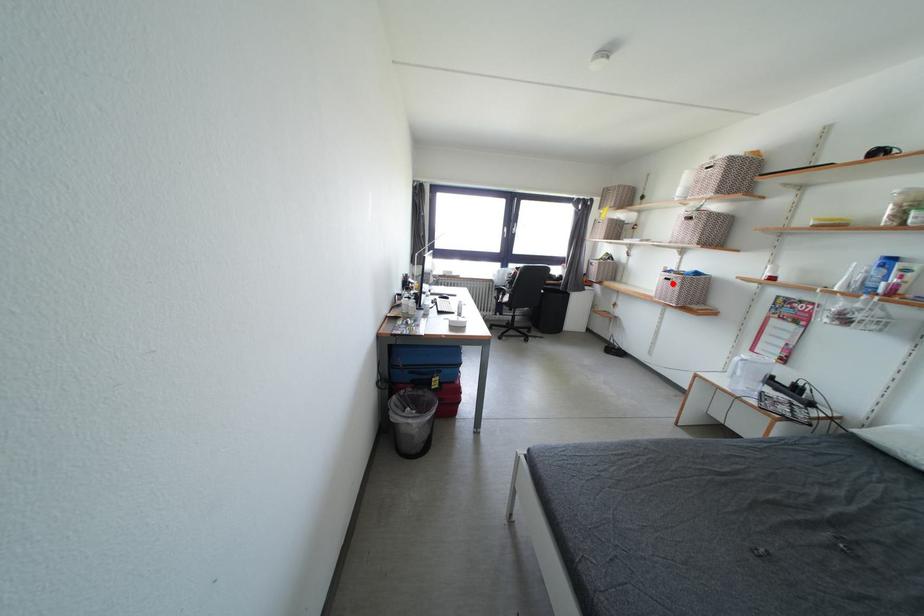
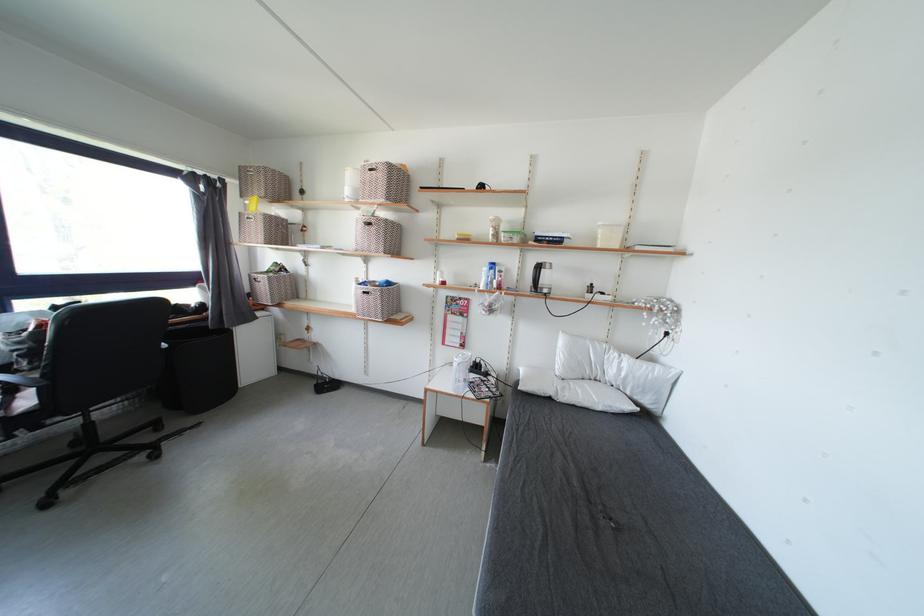
In the second image, find the point that corresponds to the highlighted location in the first image.

(371, 297)